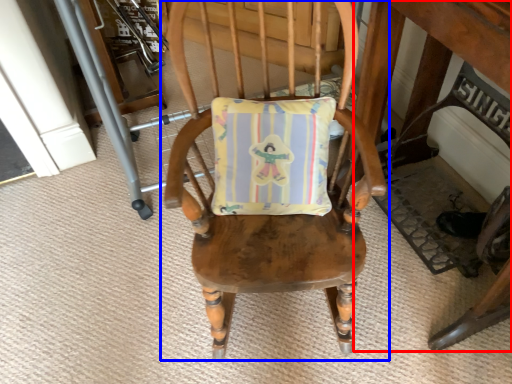
Question: Among these objects, which one is nearest to the camera, table (highlighted by a red box) or chair (highlighted by a blue box)?

Choices:
 (A) table
 (B) chair

Answer: (A)